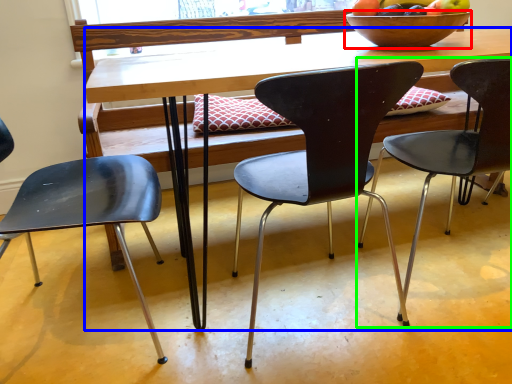
Question: Estimate the real-world distances between objects in this image. Which object is farther from bowl (highlighted by a red box), desk (highlighted by a blue box) or chair (highlighted by a green box)?

Choices:
 (A) desk
 (B) chair

Answer: (B)